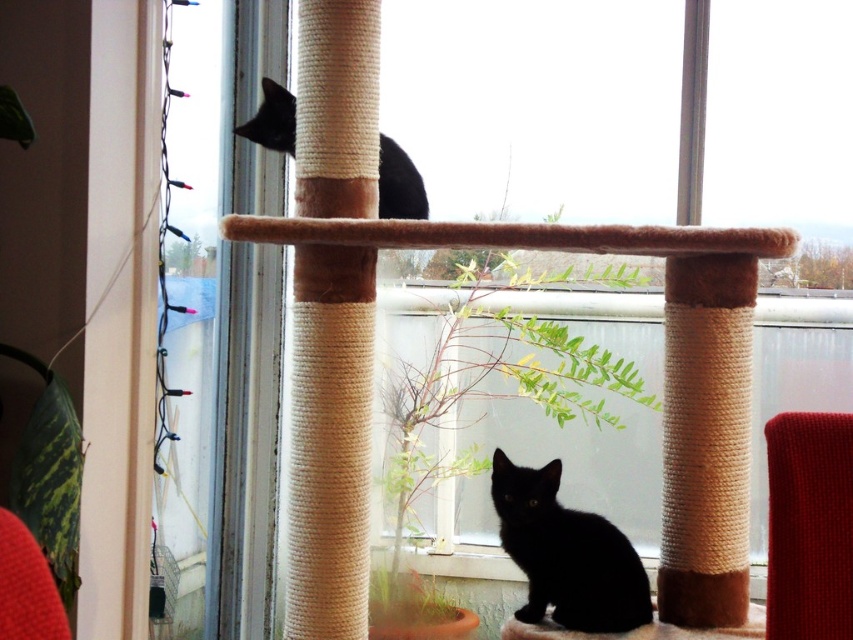
Does matte black cat at lower center have a greater width compared to black matte cat at upper left?

Incorrect, matte black cat at lower center's width does not surpass black matte cat at upper left's.

Is matte black cat at lower center taller than black matte cat at upper left?

Indeed, matte black cat at lower center has a greater height compared to black matte cat at upper left.

Does point (611, 532) lie behind point (242, 131)?

That is False.

Find the location of a particular element. matte black cat at lower center is located at coordinates (566, 554).